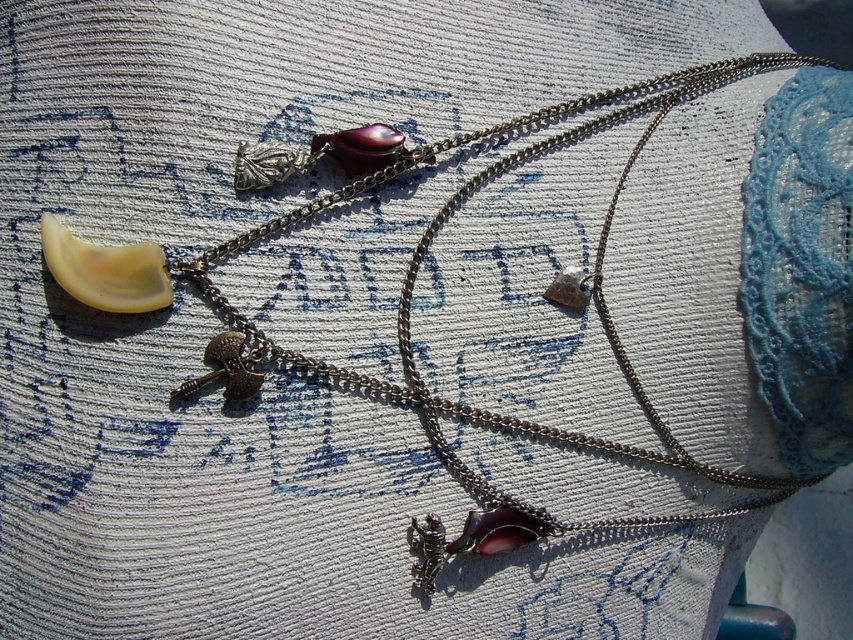
The height and width of the screenshot is (640, 853). I want to click on gold metallic hammer at center, so click(224, 369).

Is gold metallic hammer at center below matte silver charm at center?

Indeed, gold metallic hammer at center is positioned under matte silver charm at center.

Measure the distance between gold metallic hammer at center and camera.

A distance of 1.05 meters exists between gold metallic hammer at center and camera.

Locate an element on the screen. This screenshot has height=640, width=853. gold metallic hammer at center is located at coordinates (224, 369).